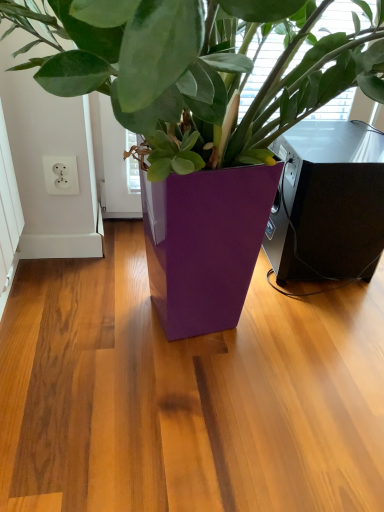
Find the location of a particular element. vacant space in front of metallic black speaker at right is located at coordinates (310, 325).